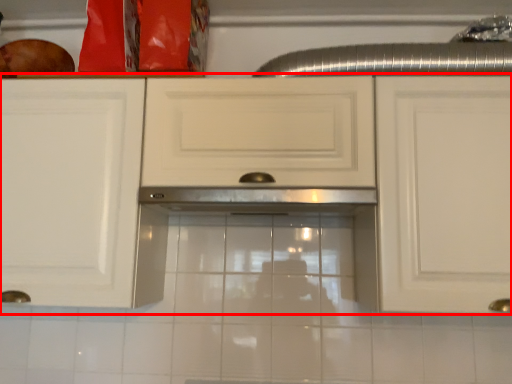
Question: From the image's perspective, what is the correct spatial relationship of cabinetry (annotated by the red box) in relation to exhaust hood?

Choices:
 (A) below
 (B) above

Answer: (B)